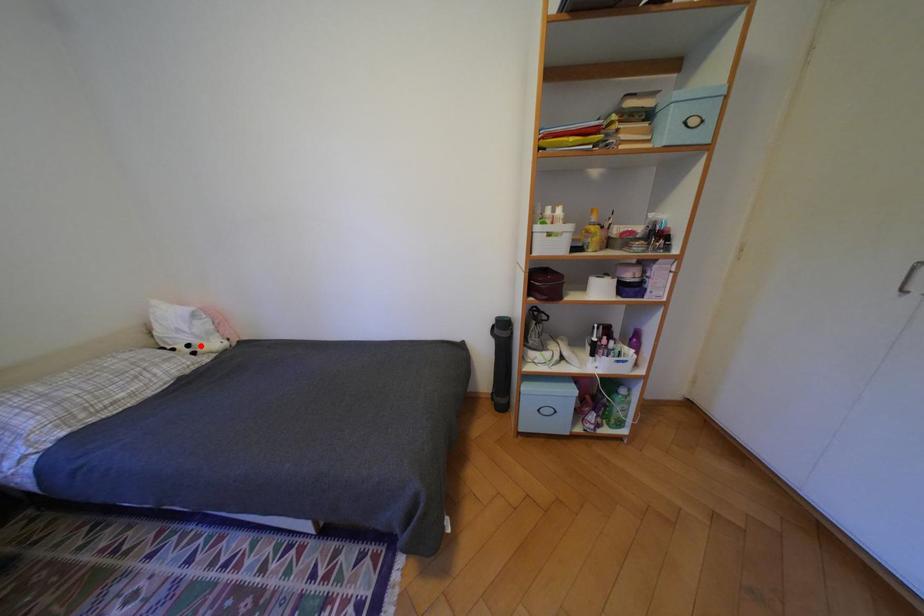
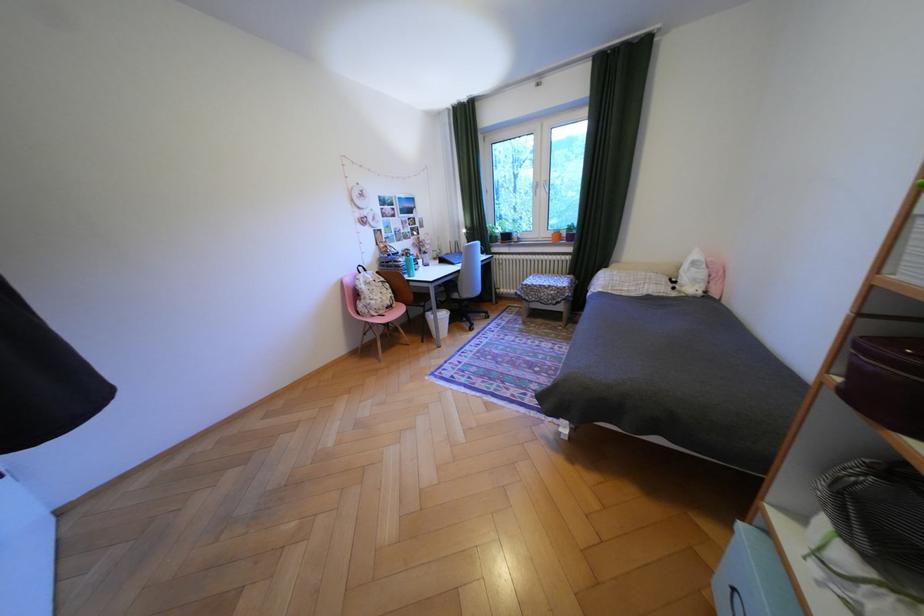
Where in the second image is the point corresponding to the highlighted location from the first image?

(687, 282)